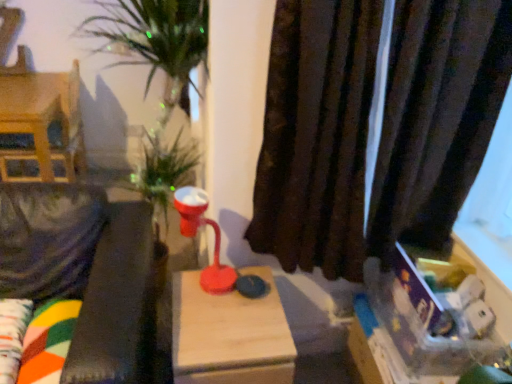
Find the location of a particular element. vacant space situated above wooden table at center (from a real-world perspective) is located at coordinates (224, 309).